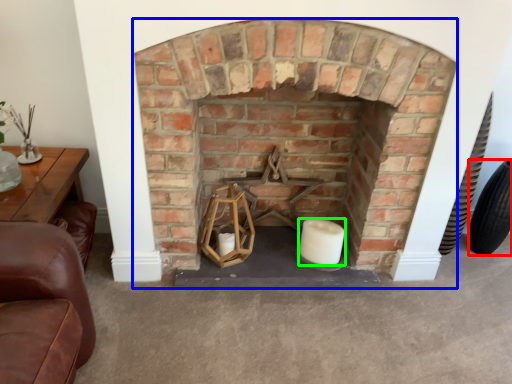
Question: Estimate the real-world distances between objects in this image. Which object is closer to tire (highlighted by a red box), fireplace (highlighted by a blue box) or candle (highlighted by a green box)?

Choices:
 (A) fireplace
 (B) candle

Answer: (B)